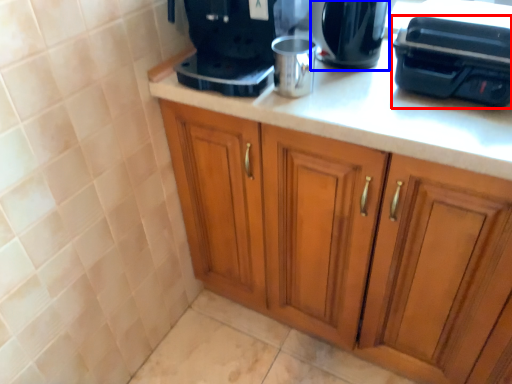
Question: Among these objects, which one is farthest to the camera, appliance (highlighted by a red box) or kitchen appliance (highlighted by a blue box)?

Choices:
 (A) appliance
 (B) kitchen appliance

Answer: (B)